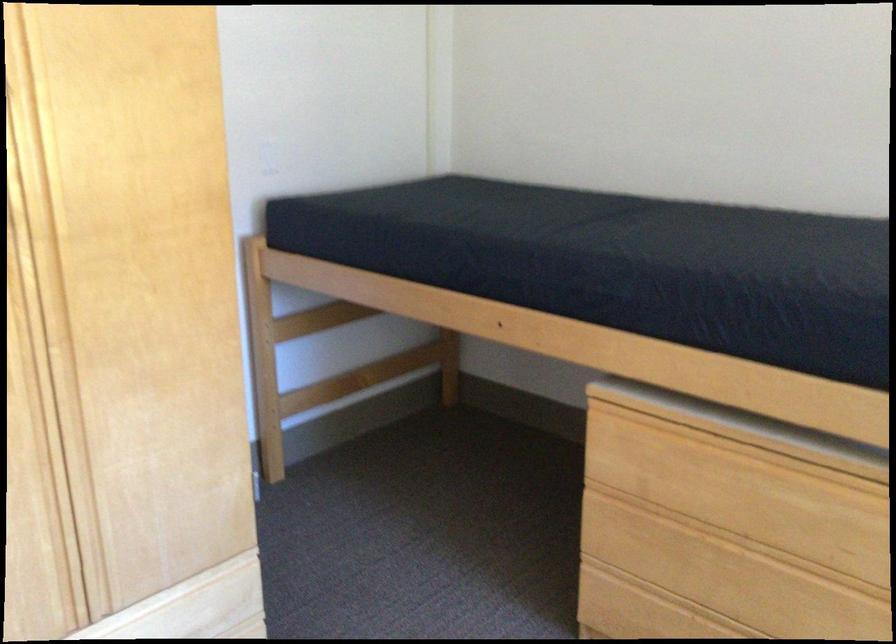
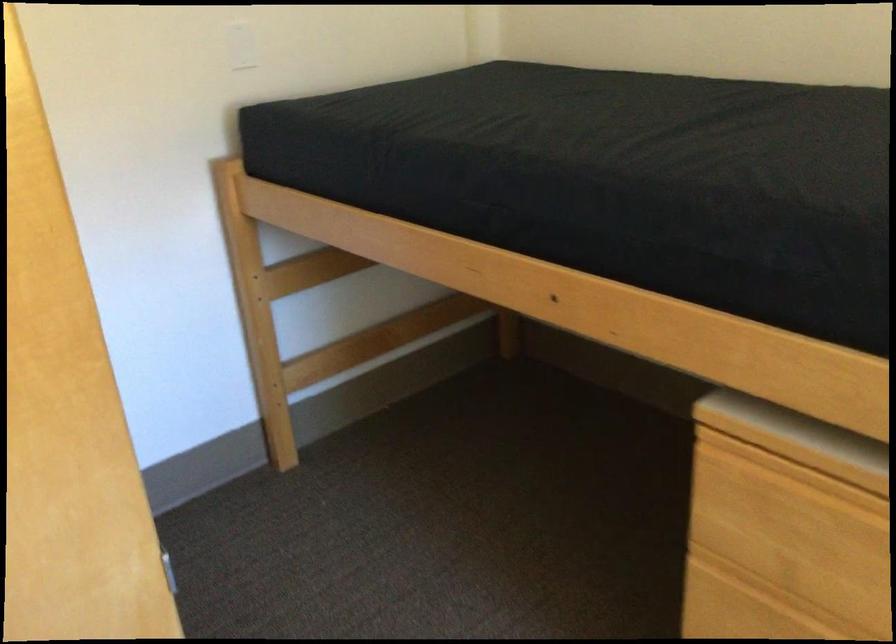
In the second image, find the point that corresponds to pixel 306 400 in the first image.

(319, 368)